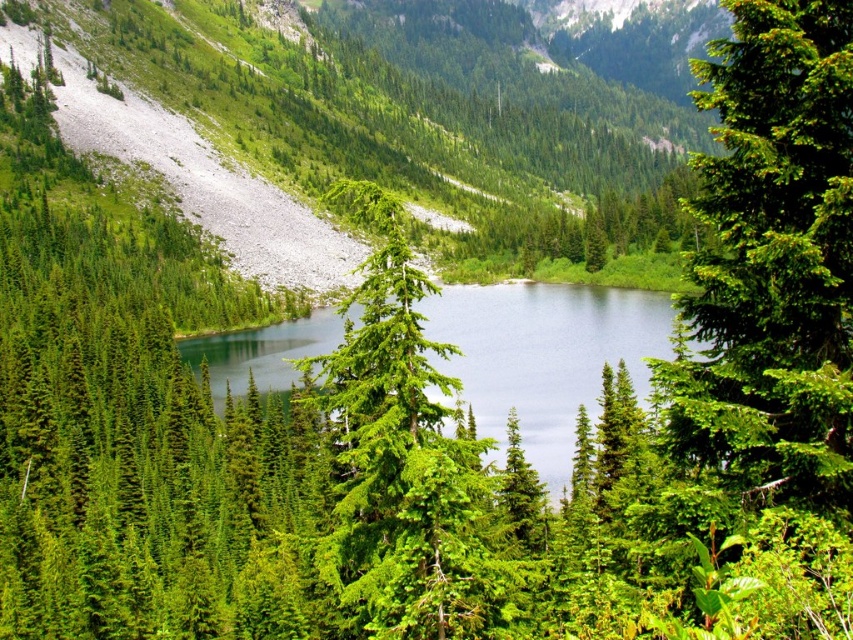
You are a hiker standing at the edge of the clear blue water at center. You want to take a photo of the green matte evergreen tree at upper right. Which direction should you face to capture the tree in your view?

The green matte evergreen tree at upper right is taller than the clear blue water at center. To capture the tree in your view, you should face towards the upper right direction from your current position at the clear blue water at center.